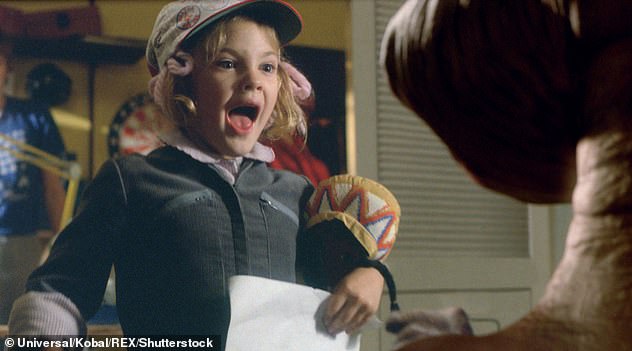
At what (x,y) coordinates should I click in order to perform the action: click on door. Please return your answer as a coordinate pair (x, y). Looking at the image, I should click on (470, 185).